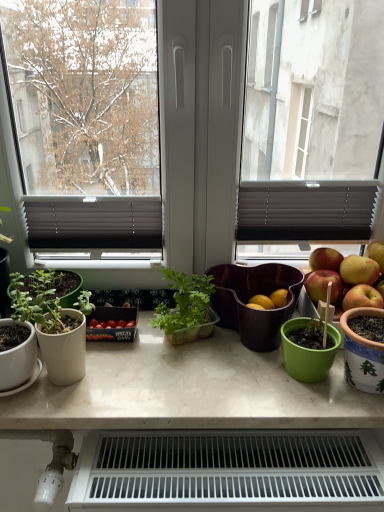
Image resolution: width=384 pixels, height=512 pixels. Find the location of `free space in front of matte white pot at left, which is the 2th houseplant from right to left`. free space in front of matte white pot at left, which is the 2th houseplant from right to left is located at coordinates (63, 406).